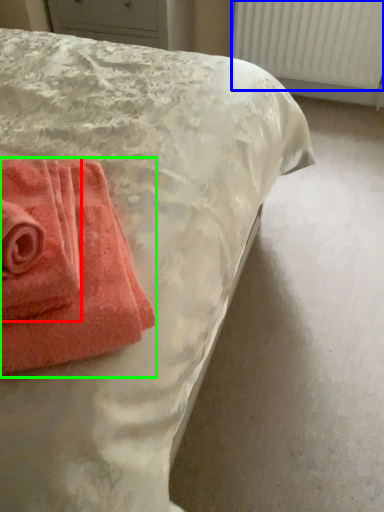
Question: Which object is the farthest from towel (highlighted by a red box)? Choose among these: radiator (highlighted by a blue box) or towel (highlighted by a green box).

Choices:
 (A) radiator
 (B) towel

Answer: (A)